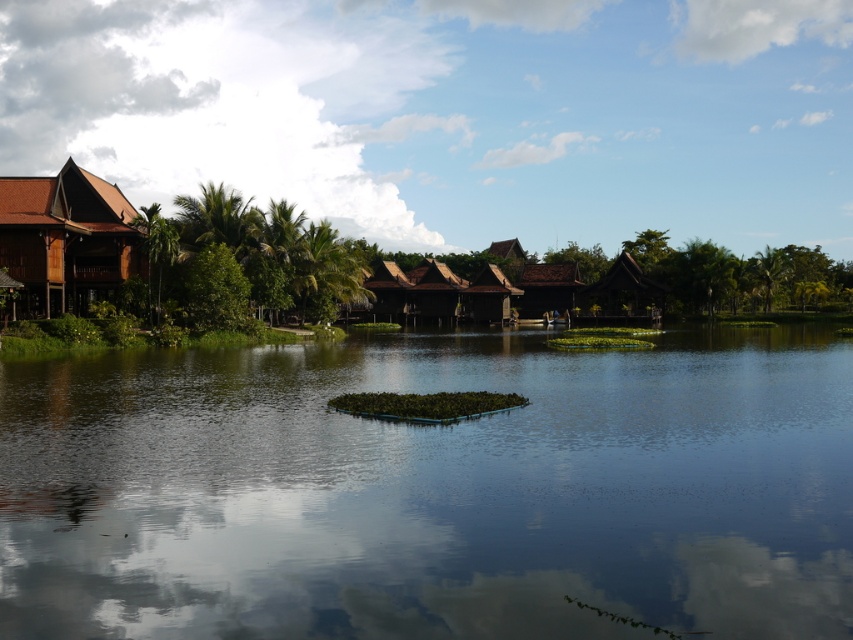
You are standing at the lakeside and want to cross to the other side. The transparent water at center is your path. Considering the matte brown wooden hut at left is nearby, can you estimate if the water path is wide enough for a small boat?

The transparent water at center might be wider than matte brown wooden hut at left, so the water path could be wide enough for a small boat to pass through.